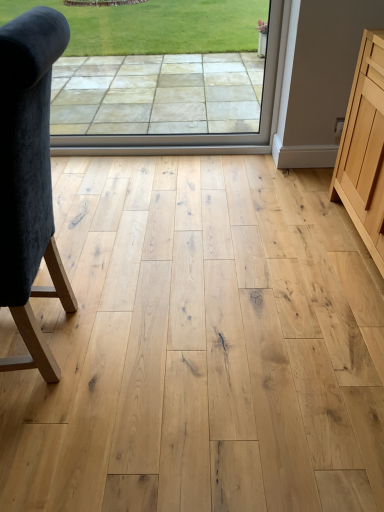
Find the location of `free space in front of velvet dark blue chair at left`. free space in front of velvet dark blue chair at left is located at coordinates (62, 439).